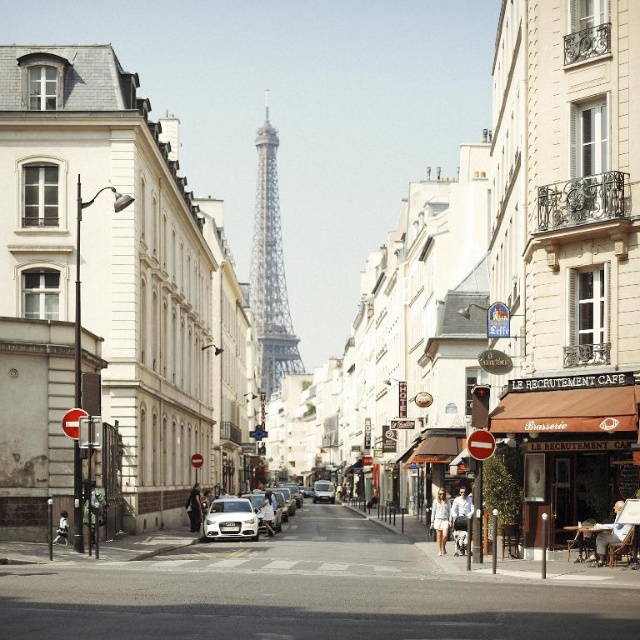
You are standing on a Parisian street with the Eiffel Tower in the background. You see two points marked on the ground at coordinates point [444,518] and point [65,531]. If you want to walk towards the Eiffel Tower, which point should you step on first?

You should step on point [65,531] first because it is closer to the Eiffel Tower than point [444,518], which is further away from the Eiffel Tower.

You are standing on the street in front of the Eiffel Tower and see two points marked in the image. The first point is at coordinates point (x=595, y=540) and the second is at point (x=328, y=492). Which point is closer to you?

Point (x=595, y=540) is closer to the viewer than point (x=328, y=492).